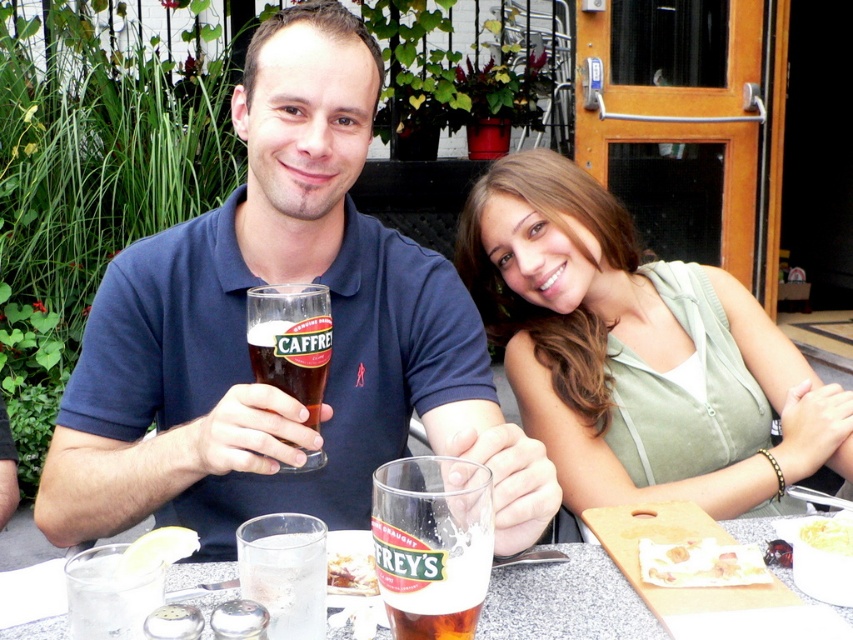
Question: Which point appears closest to the camera in this image?

Choices:
 (A) (376, 512)
 (B) (740, 572)

Answer: (A)

Question: Among these objects, which one is nearest to the camera?

Choices:
 (A) dark brown glass at center
 (B) translucent glass mug at center
 (C) golden crispy fries at center

Answer: (B)

Question: From the image, what is the correct spatial relationship of translucent glass table at center in relation to golden crispy fries at center?

Choices:
 (A) above
 (B) below

Answer: (B)

Question: Can you confirm if blue cotton shirt at center is positioned above white creamy bread at lower right?

Choices:
 (A) yes
 (B) no

Answer: (A)

Question: Which point is closer to the camera taking this photo?

Choices:
 (A) (361, 570)
 (B) (321, 312)

Answer: (B)

Question: Can you confirm if green fabric top at upper right is wider than golden crispy fries at center?

Choices:
 (A) yes
 (B) no

Answer: (A)